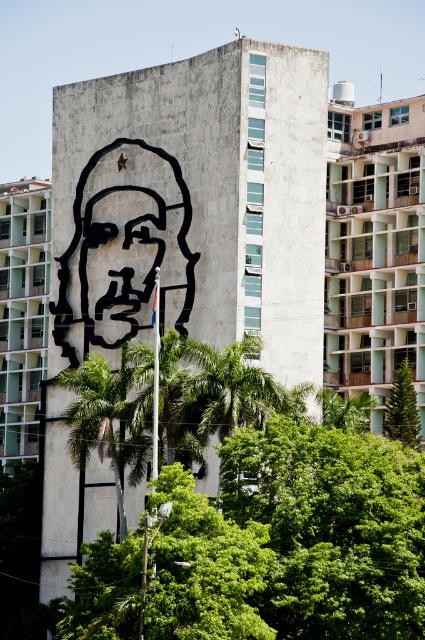
Question: Can you confirm if black matte face at center is positioned below green leafy tree at center?

Choices:
 (A) no
 (B) yes

Answer: (A)

Question: Which point is farther to the camera?

Choices:
 (A) (99, 236)
 (B) (387, 432)
 (C) (85, 301)

Answer: (C)

Question: Among these objects, which one is nearest to the camera?

Choices:
 (A) green leafy tree at center
 (B) black matte portrait at center

Answer: (B)

Question: Is black matte portrait at center positioned at the back of green leafy tree at center?

Choices:
 (A) yes
 (B) no

Answer: (B)

Question: Which of the following is the farthest from the observer?

Choices:
 (A) green leafy tree at center
 (B) black matte portrait at center

Answer: (A)

Question: Where is black matte face at center located in relation to green leafy tree at center in the image?

Choices:
 (A) below
 (B) above

Answer: (B)